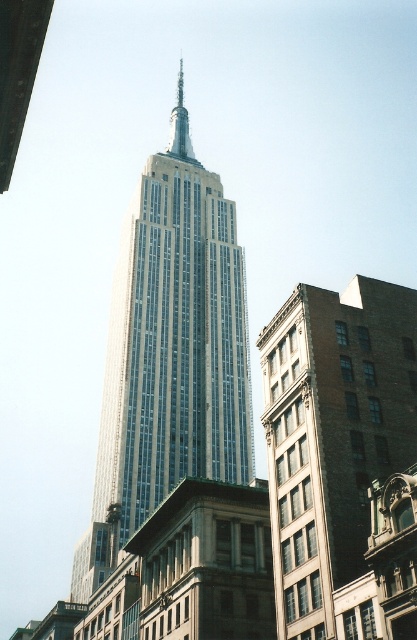
You are standing in front of the Empire State Building and want to take a photo. The camera you are using has a crosshair at point (168, 353). Where should you aim your camera to capture the glassy steel tower at center?

You should aim your camera at point (168, 353) to capture the glassy steel tower at center because that is where the glassy steel tower at center is located according to the coordinates provided.

You are standing at the base of the Empire State Building and want to take a photo of the point at coordinates point (243,433). If your camera can focus on objects up to 100 meters away, will it be able to capture that point clearly?

The distance of point (243,433) from the viewer is 109.48 meters, which exceeds the camera focus limit of 100 meters. Therefore, the camera cannot capture the point clearly.

Consider the image. You are a photographer standing in the middle of the street, aiming to capture the Empire State Building. However, there is a brown brick building at lower right blocking your view. Can you move to the left or right to avoid it and still see the glassy steel tower at center?

The brown brick building at lower right is behind the glassy steel tower at center, so moving left or right might not help since the brick building is already behind the main tower. You might need to move forward or backward instead.